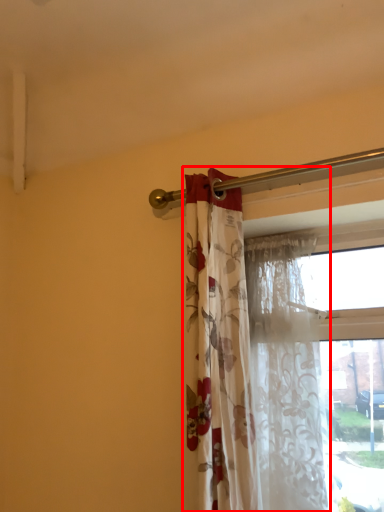
Question: In this image, where is curtain (annotated by the red box) located relative to curtain?

Choices:
 (A) right
 (B) left

Answer: (B)